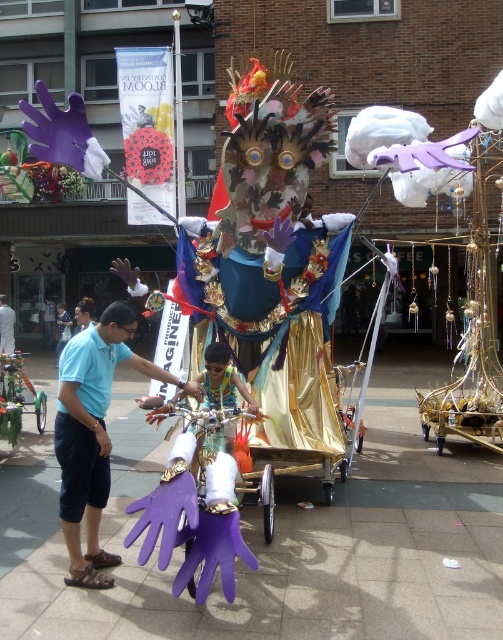
You are a photographer trying to capture the puppet in the scene. You notice the purple rubber gloves at center and the matte blue shirt at left. Which object should you focus on first if you want to take a clear photo of the closer item?

The purple rubber gloves at center is closer to the viewer than the matte blue shirt at left, so you should focus on the purple rubber gloves at center first to capture the closer item clearly.